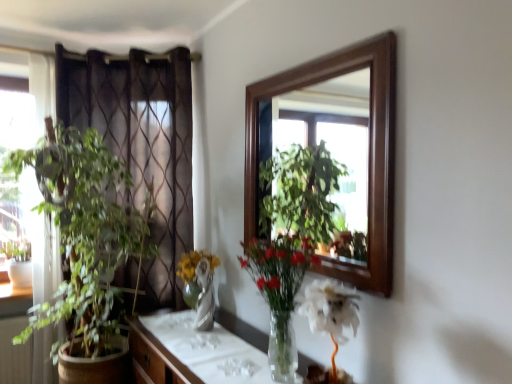
Question: Is translucent glass vase at center, which is the second houseplant from left to right, looking in the opposite direction of brown sheer curtain at left?

Choices:
 (A) yes
 (B) no

Answer: (B)

Question: Can you confirm if translucent glass vase at center, marked as the 1th houseplant in a right-to-left arrangement, is positioned to the right of brown sheer curtain at left?

Choices:
 (A) yes
 (B) no

Answer: (A)

Question: Is translucent glass vase at center, marked as the 1th houseplant in a right-to-left arrangement, positioned far away from brown sheer curtain at left?

Choices:
 (A) yes
 (B) no

Answer: (A)

Question: Is translucent glass vase at center, marked as the 1th houseplant in a right-to-left arrangement, bigger than brown sheer curtain at left?

Choices:
 (A) yes
 (B) no

Answer: (B)

Question: From the image's perspective, is translucent glass vase at center, marked as the 1th houseplant in a right-to-left arrangement, under brown sheer curtain at left?

Choices:
 (A) yes
 (B) no

Answer: (A)

Question: Is translucent glass vase at center, marked as the 1th houseplant in a right-to-left arrangement, facing towards brown sheer curtain at left?

Choices:
 (A) no
 (B) yes

Answer: (A)

Question: From a real-world perspective, is green leafy plant at left, the second houseplant when ordered from right to left, on top of brown sheer curtain at left?

Choices:
 (A) yes
 (B) no

Answer: (B)

Question: Is brown sheer curtain at left a part of green leafy plant at left, the second houseplant when ordered from right to left?

Choices:
 (A) yes
 (B) no

Answer: (B)

Question: Is green leafy plant at left, the second houseplant when ordered from right to left, to the right of brown sheer curtain at left from the viewer's perspective?

Choices:
 (A) yes
 (B) no

Answer: (B)

Question: From the image's perspective, would you say green leafy plant at left, the first houseplant when ordered from back to front, is positioned over brown sheer curtain at left?

Choices:
 (A) no
 (B) yes

Answer: (A)

Question: Does green leafy plant at left, the first houseplant when ordered from back to front, turn towards brown sheer curtain at left?

Choices:
 (A) no
 (B) yes

Answer: (B)

Question: Does green leafy plant at left, the first houseplant when ordered from back to front, have a lesser height compared to brown sheer curtain at left?

Choices:
 (A) yes
 (B) no

Answer: (A)

Question: Are translucent glass vase at center, which is the second houseplant from left to right, and wooden cabinet at center far apart?

Choices:
 (A) no
 (B) yes

Answer: (A)